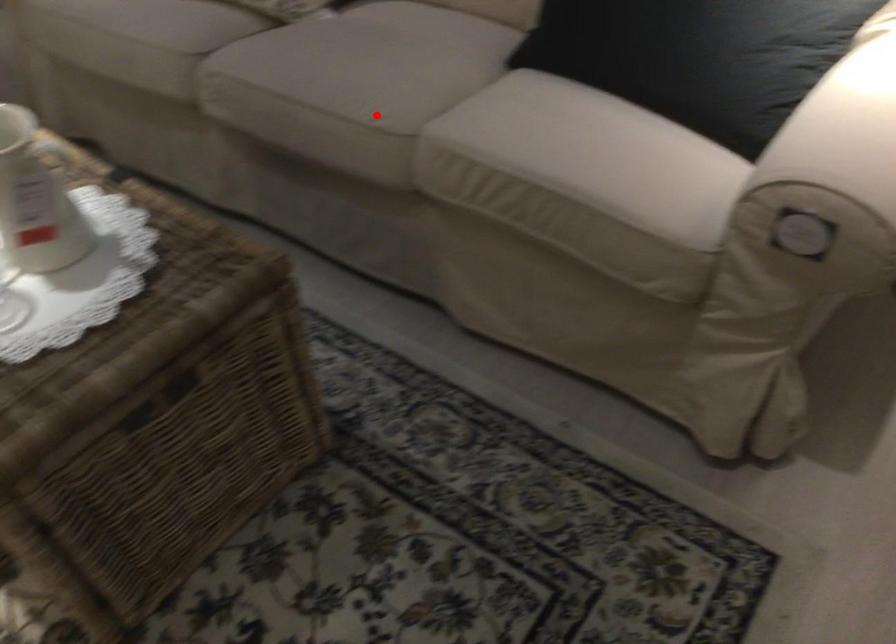
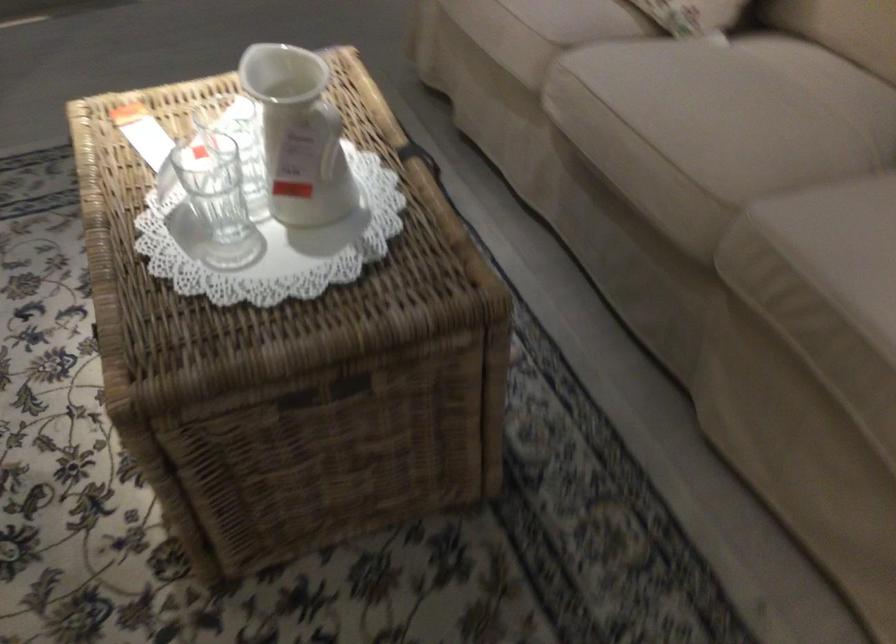
Question: I am providing you with two images of the same scene from different viewpoints. Given a red point in image1, look at the same physical point in image2. Is it:

Choices:
 (A) Closer to the viewpoint
 (B) Farther from the viewpoint

Answer: (A)